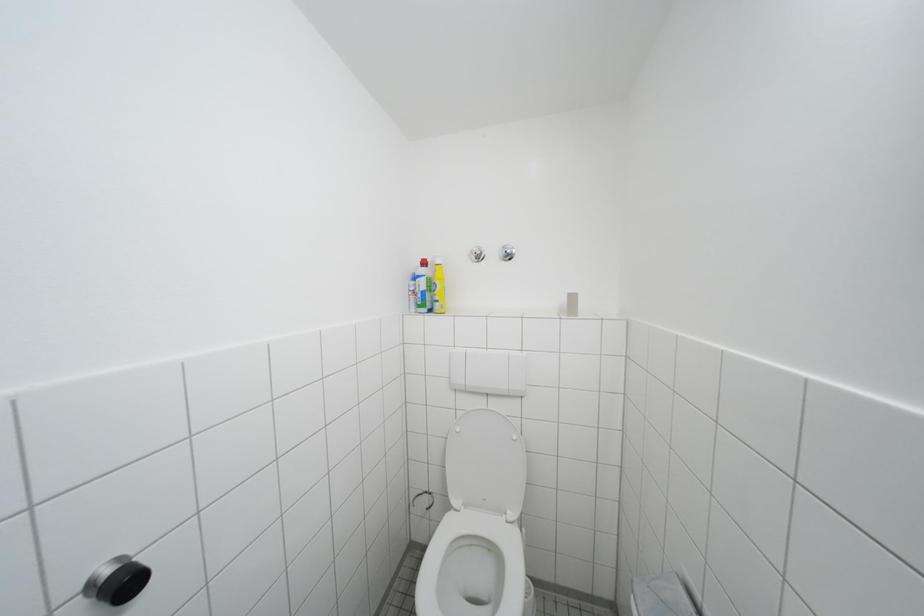
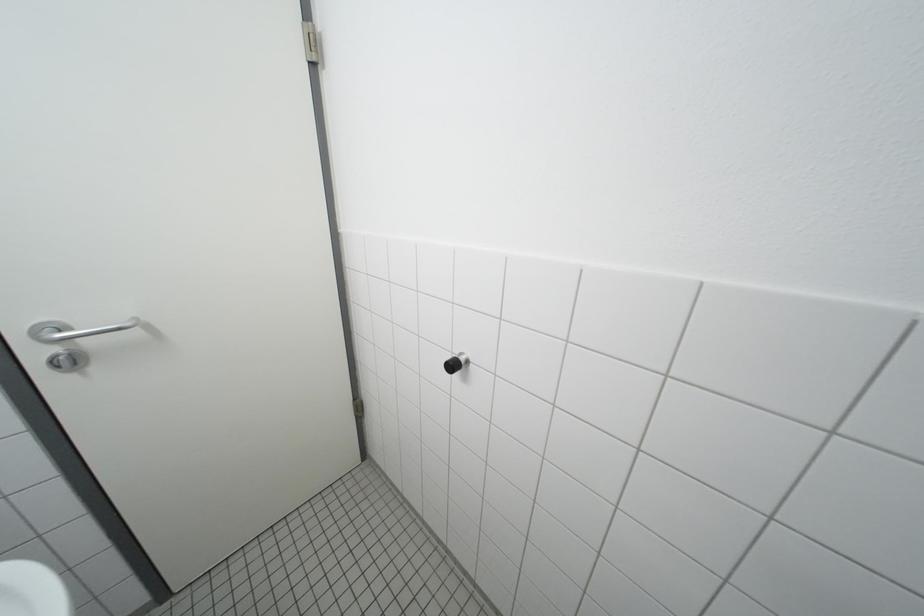
The first image is from the beginning of the video and the second image is from the end. How did the camera likely rotate when shooting the video?

The rotation direction of the camera is left-down.